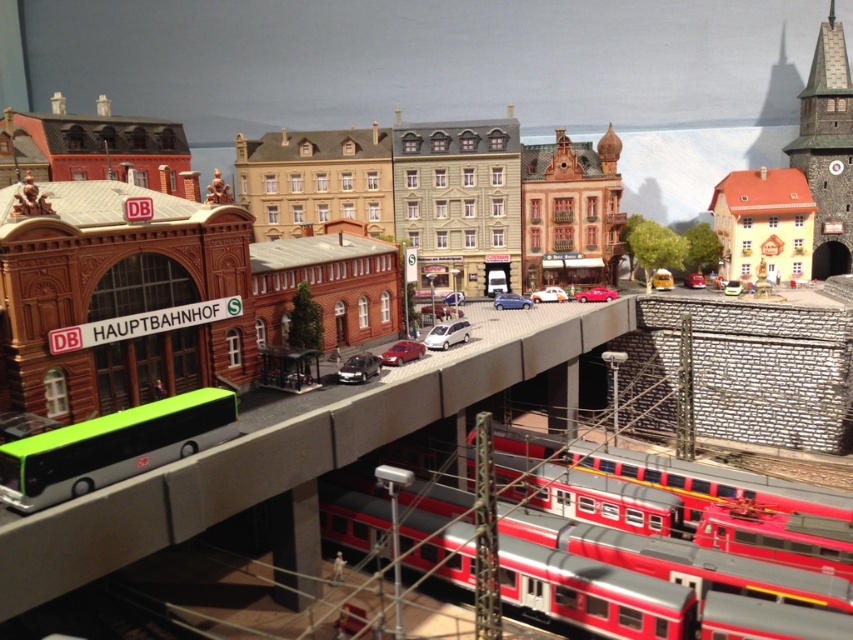
You are a model train enthusiast planning to add a new car to the red matte passenger train at lower center. The new car you have is the same width as the satin red car at center. Will the new car fit in terms of width if you attach it to the existing train?

The red matte passenger train at lower center might be wider than the satin red car at center, so the new car may fit, but there is uncertainty due to the possible width difference. Check the exact measurements before attaching.

You are a model train enthusiast examining the miniature scene. You notice the red matte passenger train at lower center and the satin red car at center. Which of these two vehicles is located to the right in the scene?

The red matte passenger train at lower center is positioned on the right side of the satin red car at center, so it is located to the right of the satin red car at center in the scene.